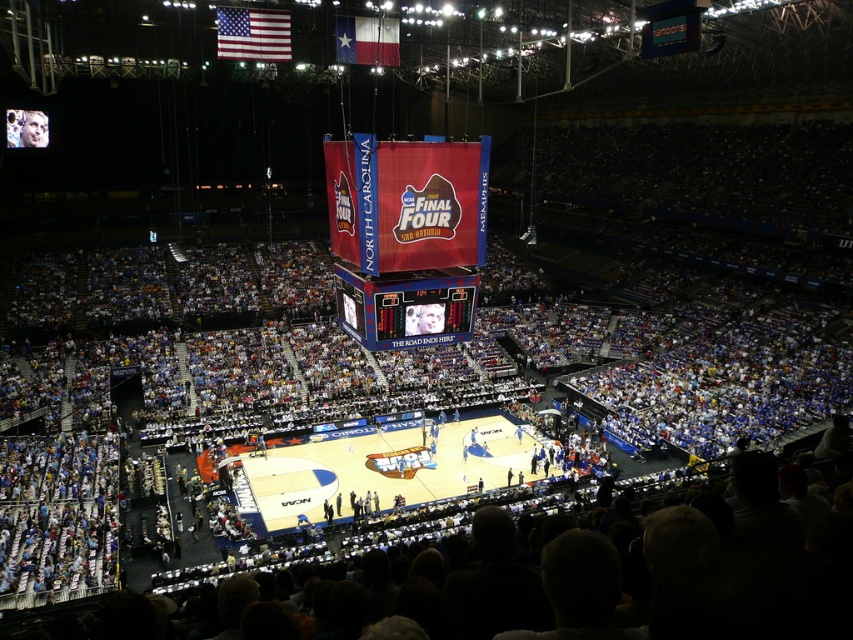
You are a photographer at the 2005 NCAA Final Four basketball tournament at the Alamodome. You want to take a picture of the court with the American flag at upper left in the background. To ensure the flag is visible, where should you position yourself relative to the court?

The American flag at upper left is located at point (x=253, y=33), so you should position yourself near the lower right side of the court to capture the flag in the background.

You are a photographer at the 2005 NCAA Final Four basketball tournament. You want to capture a photo that includes both the american flag at upper left and the blue fabric flag at upper center. Which flag should you focus on first if you want to ensure both are in frame without moving the camera?

The american flag at upper left is larger in size than the blue fabric flag at upper center, so you should focus on the american flag at upper left first to ensure it fits properly in the frame before adjusting for the smaller blue fabric flag at upper center.